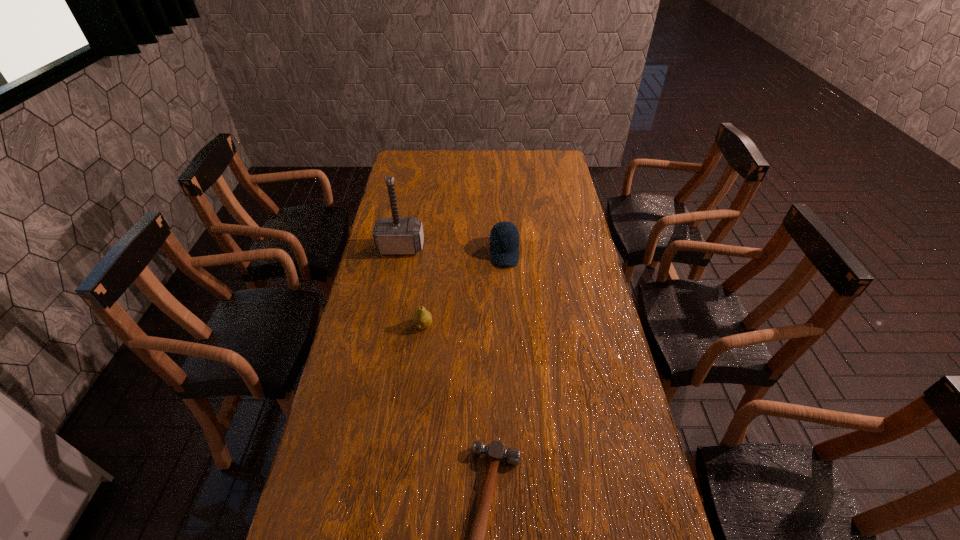
In the image, there is a desktop. Where is `vacant space at the left edge`? The width and height of the screenshot is (960, 540). vacant space at the left edge is located at coordinates (370, 301).

Identify the location of vacant area at the right edge of the desktop. (571, 293).

You are a GUI agent. You are given a task and a screenshot of the screen. Output one action in this format:
    pyautogui.click(x=<x>, y=<y>)
    Task: Click on the empty space that is in between the baseball cap and the leftmost object
    The height and width of the screenshot is (540, 960).
    Given the screenshot: What is the action you would take?
    click(453, 250)

Find the location of `unoccupied position between the farther hammer and the baseball cap`. unoccupied position between the farther hammer and the baseball cap is located at coordinates (453, 250).

You are a GUI agent. You are given a task and a screenshot of the screen. Output one action in this format:
    pyautogui.click(x=<x>, y=<y>)
    Task: Click on the unoccupied position between the baseball cap and the second nearest object
    This screenshot has height=540, width=960.
    Given the screenshot: What is the action you would take?
    pyautogui.click(x=464, y=289)

Find the location of a particular element. This screenshot has width=960, height=540. free spot between the leftmost object and the second nearest object is located at coordinates (412, 287).

You are a GUI agent. You are given a task and a screenshot of the screen. Output one action in this format:
    pyautogui.click(x=<x>, y=<y>)
    Task: Click on the free point between the baseball cap and the third farthest object
    The width and height of the screenshot is (960, 540).
    Given the screenshot: What is the action you would take?
    pyautogui.click(x=464, y=289)

Where is `free spot between the pear and the leftmost object`? This screenshot has height=540, width=960. free spot between the pear and the leftmost object is located at coordinates (412, 287).

Where is `object that stands as the second closest to the leftmost object`? This screenshot has height=540, width=960. object that stands as the second closest to the leftmost object is located at coordinates (422, 318).

Locate which object is the third closest to the left hammer. Please provide its 2D coordinates. Your answer should be formatted as a tuple, i.e. [(x, y)], where the tuple contains the x and y coordinates of a point satisfying the conditions above.

[(496, 451)]